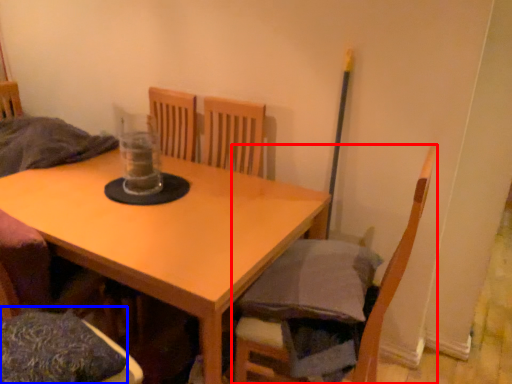
Question: Which object is closer to the camera taking this photo, chair (highlighted by a red box) or pillow (highlighted by a blue box)?

Choices:
 (A) chair
 (B) pillow

Answer: (B)